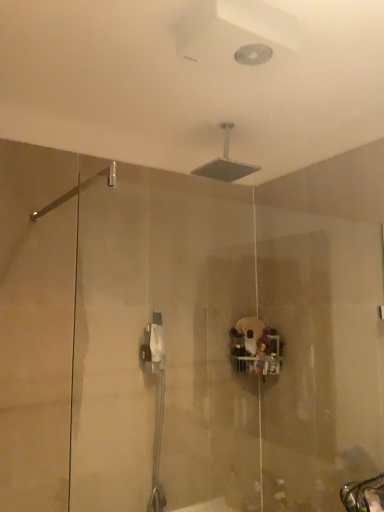
Measure the distance between point (114, 167) and camera.

1.24 meters.

This screenshot has width=384, height=512. Find the location of `silver metallic grab bar at upper left, the 2th shower in the back-to-front sequence`. silver metallic grab bar at upper left, the 2th shower in the back-to-front sequence is located at coordinates (78, 190).

What do you see at coordinates (78, 190) in the screenshot?
I see `silver metallic grab bar at upper left, marked as the 1th shower in a front-to-back arrangement` at bounding box center [78, 190].

This screenshot has height=512, width=384. What do you see at coordinates (225, 163) in the screenshot?
I see `matte silver showerhead at upper center, the 2th shower from the left` at bounding box center [225, 163].

Find the location of a particular element. The image size is (384, 512). matte silver showerhead at upper center, the 2th shower in the bottom-to-top sequence is located at coordinates (225, 163).

Measure the distance between point (196, 172) and camera.

The distance of point (196, 172) from camera is 6.32 feet.

Locate an element on the screen. silver metallic grab bar at upper left, marked as the 1th shower in a front-to-back arrangement is located at coordinates (78, 190).

Is matte silver showerhead at upper center, the 2th shower from the left, at the right side of silver metallic grab bar at upper left, the 2th shower viewed from the top?

Indeed, matte silver showerhead at upper center, the 2th shower from the left, is positioned on the right side of silver metallic grab bar at upper left, the 2th shower viewed from the top.

Which object is closer to the camera, matte silver showerhead at upper center, the 1th shower in the back-to-front sequence, or silver metallic grab bar at upper left, the 1th shower ordered from the bottom?

silver metallic grab bar at upper left, the 1th shower ordered from the bottom, is in front.

Does point (222, 169) appear closer or farther from the camera than point (114, 183)?

Point (222, 169) is farther from the camera than point (114, 183).

From the image's perspective, is matte silver showerhead at upper center, the 2th shower in the bottom-to-top sequence, on top of silver metallic grab bar at upper left, the 2th shower in the right-to-left sequence?

Correct, matte silver showerhead at upper center, the 2th shower in the bottom-to-top sequence, appears higher than silver metallic grab bar at upper left, the 2th shower in the right-to-left sequence, in the image.

From a real-world perspective, is matte silver showerhead at upper center, the 1th shower in the back-to-front sequence, physically below silver metallic grab bar at upper left, the 2th shower in the right-to-left sequence?

No, from a real-world perspective, matte silver showerhead at upper center, the 1th shower in the back-to-front sequence, is not below silver metallic grab bar at upper left, the 2th shower in the right-to-left sequence.

Considering the relative sizes of matte silver showerhead at upper center, the 2th shower from the left, and silver metallic grab bar at upper left, the 1th shower ordered from the bottom, in the image provided, is matte silver showerhead at upper center, the 2th shower from the left, thinner than silver metallic grab bar at upper left, the 1th shower ordered from the bottom,?

Yes.

Considering the relative sizes of matte silver showerhead at upper center, the 2th shower from the left, and silver metallic grab bar at upper left, the 2th shower in the right-to-left sequence, in the image provided, is matte silver showerhead at upper center, the 2th shower from the left, taller than silver metallic grab bar at upper left, the 2th shower in the right-to-left sequence,?

Indeed, matte silver showerhead at upper center, the 2th shower from the left, has a greater height compared to silver metallic grab bar at upper left, the 2th shower in the right-to-left sequence.

Between matte silver showerhead at upper center, acting as the first shower starting from the right, and silver metallic grab bar at upper left, which ranks as the first shower in left-to-right order, which one has smaller size?

silver metallic grab bar at upper left, which ranks as the first shower in left-to-right order, is smaller.

Is matte silver showerhead at upper center, the first shower viewed from the top, located outside silver metallic grab bar at upper left, marked as the 1th shower in a front-to-back arrangement?

That's correct, matte silver showerhead at upper center, the first shower viewed from the top, is outside of silver metallic grab bar at upper left, marked as the 1th shower in a front-to-back arrangement.

In the scene shown: Is matte silver showerhead at upper center, the 1th shower in the back-to-front sequence, not close to silver metallic grab bar at upper left, which ranks as the first shower in left-to-right order?

No, matte silver showerhead at upper center, the 1th shower in the back-to-front sequence, is not far from silver metallic grab bar at upper left, which ranks as the first shower in left-to-right order.

Is matte silver showerhead at upper center, acting as the first shower starting from the right, turned away from silver metallic grab bar at upper left, the 2th shower viewed from the top?

matte silver showerhead at upper center, acting as the first shower starting from the right, does not have its back to silver metallic grab bar at upper left, the 2th shower viewed from the top.

How many degrees apart are the facing directions of matte silver showerhead at upper center, the 1th shower in the back-to-front sequence, and silver metallic grab bar at upper left, the 1th shower ordered from the bottom?

They differ by 0.000557 degrees in their facing directions.

How far apart are matte silver showerhead at upper center, the first shower viewed from the top, and silver metallic grab bar at upper left, which ranks as the first shower in left-to-right order?

matte silver showerhead at upper center, the first shower viewed from the top, is 22.68 inches from silver metallic grab bar at upper left, which ranks as the first shower in left-to-right order.

The image size is (384, 512). What are the coordinates of `shower below the matte silver showerhead at upper center, the 2th shower in the bottom-to-top sequence (from the image's perspective)` in the screenshot? It's located at (78, 190).

Considering the positions of objects silver metallic grab bar at upper left, the 2th shower viewed from the top, and matte silver showerhead at upper center, acting as the first shower starting from the right, in the image provided, who is more to the right, silver metallic grab bar at upper left, the 2th shower viewed from the top, or matte silver showerhead at upper center, acting as the first shower starting from the right,?

From the viewer's perspective, matte silver showerhead at upper center, acting as the first shower starting from the right, appears more on the right side.

Is the depth of silver metallic grab bar at upper left, the 2th shower in the back-to-front sequence, greater than that of matte silver showerhead at upper center, the 2th shower from the left?

That is False.

Which is closer to the camera, (46, 213) or (224, 164)?

Point (46, 213)

From the image's perspective, is silver metallic grab bar at upper left, the 2th shower viewed from the top, beneath matte silver showerhead at upper center, acting as the first shower starting from the right?

Yes, from the image's perspective, silver metallic grab bar at upper left, the 2th shower viewed from the top, is below matte silver showerhead at upper center, acting as the first shower starting from the right.

From a real-world perspective, is silver metallic grab bar at upper left, the 2th shower in the right-to-left sequence, physically below matte silver showerhead at upper center, the 1th shower in the back-to-front sequence?

Yes.

Is silver metallic grab bar at upper left, which ranks as the first shower in left-to-right order, wider than matte silver showerhead at upper center, the 1th shower in the back-to-front sequence?

Indeed, silver metallic grab bar at upper left, which ranks as the first shower in left-to-right order, has a greater width compared to matte silver showerhead at upper center, the 1th shower in the back-to-front sequence.

Does silver metallic grab bar at upper left, the 2th shower in the right-to-left sequence, have a lesser height compared to matte silver showerhead at upper center, the 1th shower in the back-to-front sequence?

Yes, silver metallic grab bar at upper left, the 2th shower in the right-to-left sequence, is shorter than matte silver showerhead at upper center, the 1th shower in the back-to-front sequence.

Looking at the image, does silver metallic grab bar at upper left, marked as the 1th shower in a front-to-back arrangement, seem bigger or smaller compared to matte silver showerhead at upper center, the 2th shower in the bottom-to-top sequence?

Clearly, silver metallic grab bar at upper left, marked as the 1th shower in a front-to-back arrangement, is smaller in size than matte silver showerhead at upper center, the 2th shower in the bottom-to-top sequence.

Looking at this image, is silver metallic grab bar at upper left, marked as the 1th shower in a front-to-back arrangement, not inside matte silver showerhead at upper center, acting as the first shower starting from the right?

silver metallic grab bar at upper left, marked as the 1th shower in a front-to-back arrangement, lies outside matte silver showerhead at upper center, acting as the first shower starting from the right,'s area.

Are silver metallic grab bar at upper left, the 2th shower in the back-to-front sequence, and matte silver showerhead at upper center, the first shower viewed from the top, far apart?

That's not correct — silver metallic grab bar at upper left, the 2th shower in the back-to-front sequence, is a little close to matte silver showerhead at upper center, the first shower viewed from the top.

Is silver metallic grab bar at upper left, the 2th shower in the right-to-left sequence, facing away from matte silver showerhead at upper center, the 2th shower from the left?

silver metallic grab bar at upper left, the 2th shower in the right-to-left sequence, is not turned away from matte silver showerhead at upper center, the 2th shower from the left.

Measure the distance between silver metallic grab bar at upper left, the 2th shower in the right-to-left sequence, and matte silver showerhead at upper center, the 2th shower from the left.

A distance of 22.68 inches exists between silver metallic grab bar at upper left, the 2th shower in the right-to-left sequence, and matte silver showerhead at upper center, the 2th shower from the left.

Locate an element on the screen. The image size is (384, 512). shower below the matte silver showerhead at upper center, the 2th shower from the left (from the image's perspective) is located at coordinates (78, 190).

Locate an element on the screen. This screenshot has width=384, height=512. shower in front of the matte silver showerhead at upper center, the first shower viewed from the top is located at coordinates (78, 190).

Locate an element on the screen. shower behind the silver metallic grab bar at upper left, the 2th shower in the right-to-left sequence is located at coordinates (225, 163).